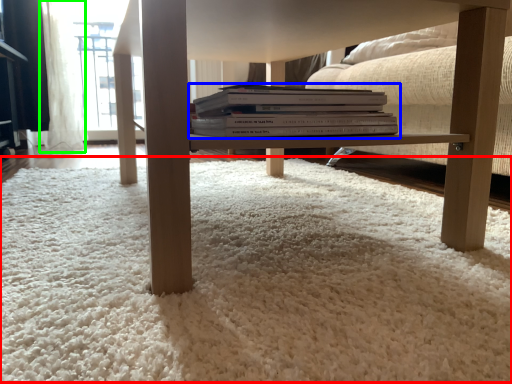
Question: Based on their relative distances, which object is farther from plain (highlighted by a red box)? Choose from book (highlighted by a blue box) and curtain (highlighted by a green box).

Choices:
 (A) book
 (B) curtain

Answer: (B)